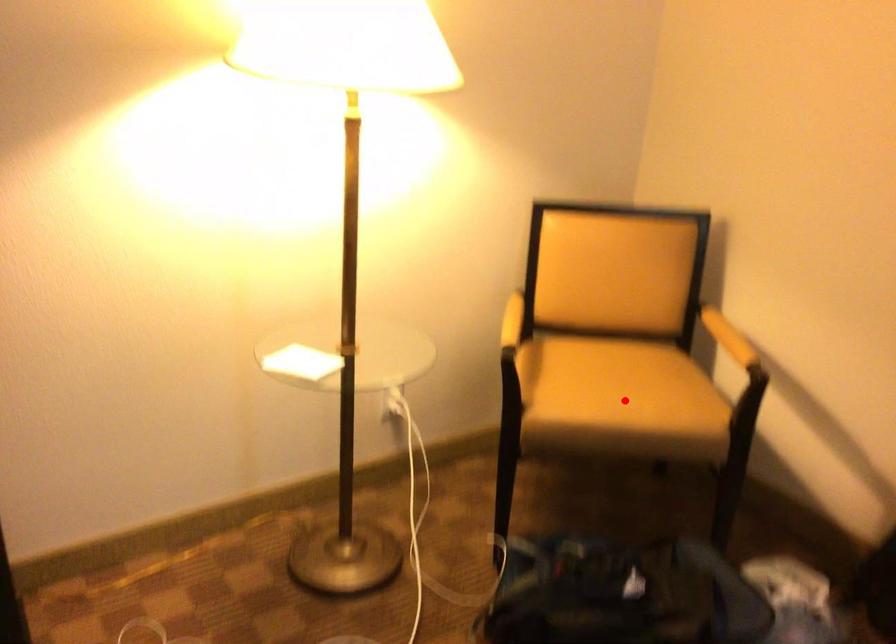
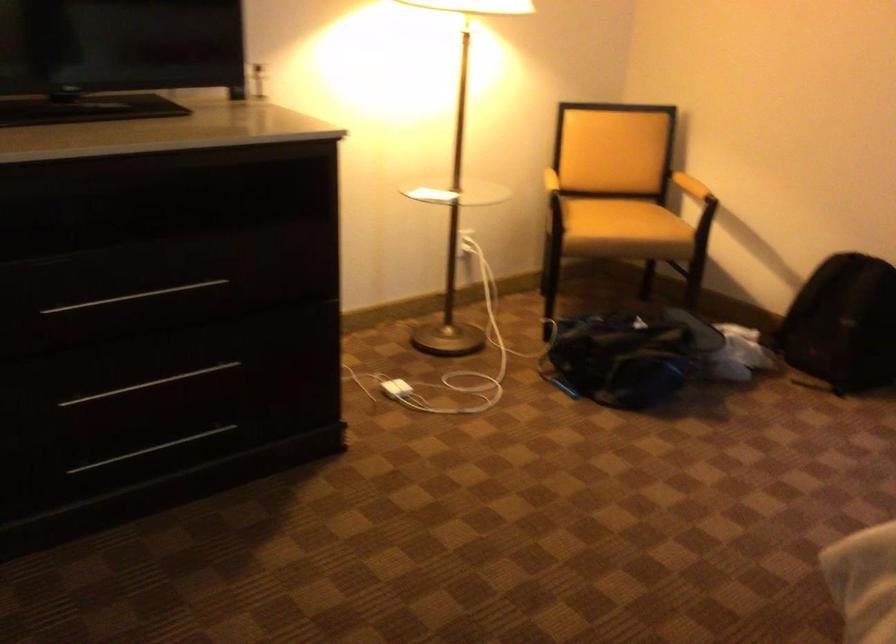
Question: I am providing you with two images of the same scene from different viewpoints. A red point is shown in image1. For the corresponding object point in image2, is it positioned nearer or farther from the camera?

Choices:
 (A) Nearer
 (B) Farther

Answer: (B)